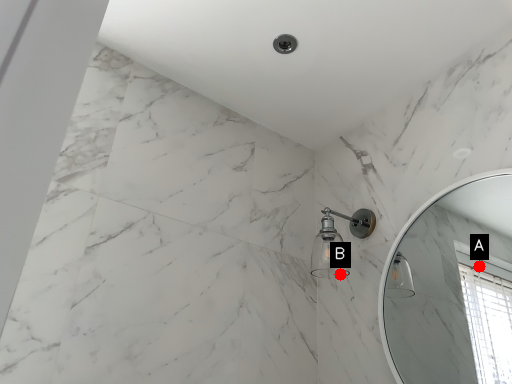
Question: Two points are circled on the image, labeled by A and B beside each circle. Which point is closer to the camera taking this photo?

Choices:
 (A) A is closer
 (B) B is closer

Answer: (B)